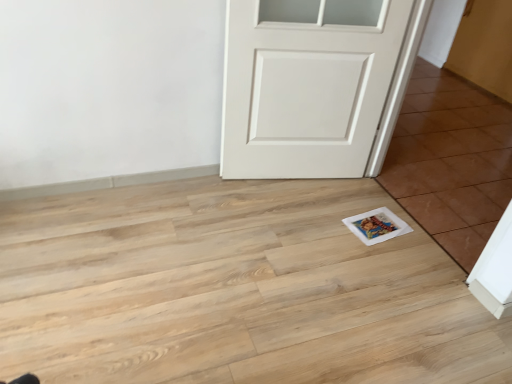
Image resolution: width=512 pixels, height=384 pixels. I want to click on vacant area that is in front of white painted wood door at center, so [286, 239].